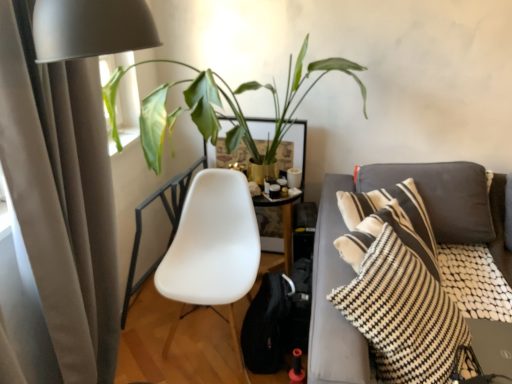
Question: From the image's perspective, does beige fabric curtain at left appear lower than white plastic chair at center?

Choices:
 (A) no
 (B) yes

Answer: (A)

Question: Could white plastic chair at center be considered to be inside beige fabric curtain at left?

Choices:
 (A) no
 (B) yes

Answer: (A)

Question: Is beige fabric curtain at left far from white plastic chair at center?

Choices:
 (A) yes
 (B) no

Answer: (B)

Question: Is beige fabric curtain at left looking in the opposite direction of white plastic chair at center?

Choices:
 (A) no
 (B) yes

Answer: (A)

Question: Is beige fabric curtain at left shorter than white plastic chair at center?

Choices:
 (A) yes
 (B) no

Answer: (B)

Question: From the image's perspective, is beige fabric curtain at left located above white plastic chair at center?

Choices:
 (A) no
 (B) yes

Answer: (B)

Question: Could you tell me if white plastic chair at center is facing green leafy plant at upper left?

Choices:
 (A) yes
 (B) no

Answer: (B)

Question: Considering the relative sizes of white plastic chair at center and green leafy plant at upper left in the image provided, is white plastic chair at center taller than green leafy plant at upper left?

Choices:
 (A) no
 (B) yes

Answer: (B)

Question: From a real-world perspective, is white plastic chair at center located higher than green leafy plant at upper left?

Choices:
 (A) no
 (B) yes

Answer: (A)

Question: Considering the relative sizes of white plastic chair at center and green leafy plant at upper left in the image provided, is white plastic chair at center smaller than green leafy plant at upper left?

Choices:
 (A) no
 (B) yes

Answer: (B)

Question: From a real-world perspective, is white plastic chair at center physically below green leafy plant at upper left?

Choices:
 (A) no
 (B) yes

Answer: (B)

Question: Does white plastic chair at center have a lesser height compared to green leafy plant at upper left?

Choices:
 (A) yes
 (B) no

Answer: (B)

Question: Are beige fabric curtain at left and black and white striped pillow at right beside each other?

Choices:
 (A) no
 (B) yes

Answer: (A)